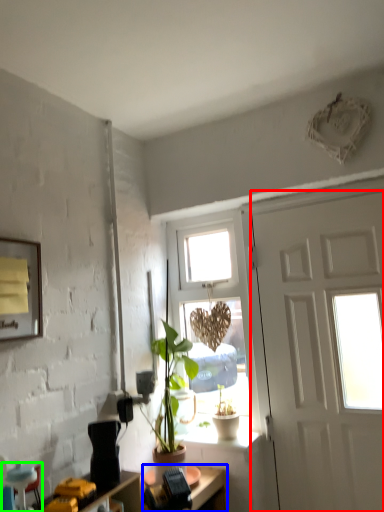
Question: Considering the real-world distances, which object is farthest from door (highlighted by a red box)? desk (highlighted by a blue box) or armchair (highlighted by a green box)?

Choices:
 (A) desk
 (B) armchair

Answer: (B)